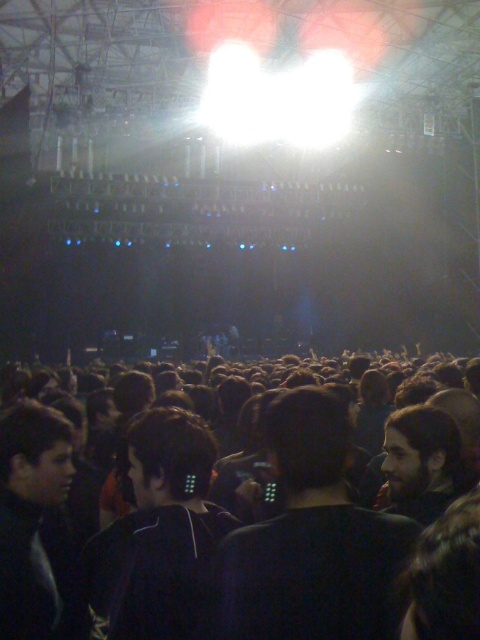
Who is more forward, (145,470) or (0,451)?

Point (0,451)

Is black matte earbuds at center positioned in front of black matte hair at center?

No, black matte earbuds at center is further to the viewer.

The height and width of the screenshot is (640, 480). What do you see at coordinates (158, 531) in the screenshot?
I see `black matte earbuds at center` at bounding box center [158, 531].

Find the location of a particular element. black matte earbuds at center is located at coordinates (158, 531).

Is point (179, 490) positioned before point (410, 428)?

Yes, it is.

Does black matte earbuds at center have a greater width compared to dark brown hair at center?

Yes.

Who is more forward, (192, 484) or (465, 465)?

Point (192, 484) is more forward.

Where is `black matte earbuds at center`? black matte earbuds at center is located at coordinates (158, 531).

Image resolution: width=480 pixels, height=640 pixels. Describe the element at coordinates (271, 525) in the screenshot. I see `black fabric crowd at center` at that location.

At what (x,y) coordinates should I click in order to perform the action: click on black fabric crowd at center. Please return your answer as a coordinate pair (x, y). Looking at the image, I should click on (271, 525).

Where is `black fabric crowd at center`? Image resolution: width=480 pixels, height=640 pixels. black fabric crowd at center is located at coordinates 271,525.